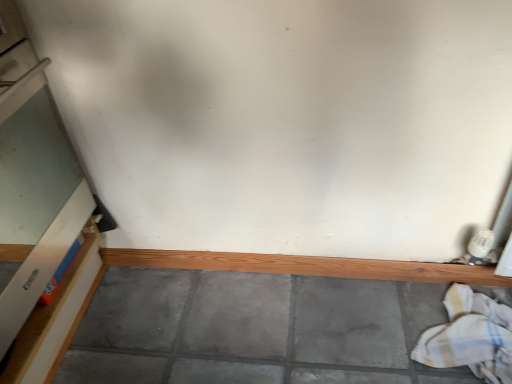
Question: Considering the relative sizes of wooden at bottom and white cotton laundry at lower right in the image provided, is wooden at bottom bigger than white cotton laundry at lower right?

Choices:
 (A) no
 (B) yes

Answer: (A)

Question: Is wooden at bottom shorter than white cotton laundry at lower right?

Choices:
 (A) yes
 (B) no

Answer: (A)

Question: Is wooden at bottom oriented towards white cotton laundry at lower right?

Choices:
 (A) yes
 (B) no

Answer: (A)

Question: Are wooden at bottom and white cotton laundry at lower right making contact?

Choices:
 (A) no
 (B) yes

Answer: (A)

Question: Is wooden at bottom closer to the viewer compared to white cotton laundry at lower right?

Choices:
 (A) no
 (B) yes

Answer: (A)

Question: Is wooden at bottom spatially inside white cardboard box at left, or outside of it?

Choices:
 (A) inside
 (B) outside

Answer: (B)

Question: Is wooden at bottom bigger or smaller than white cardboard box at left?

Choices:
 (A) small
 (B) big

Answer: (A)

Question: Considering the relative positions of wooden at bottom and white cardboard box at left in the image provided, is wooden at bottom to the left or to the right of white cardboard box at left?

Choices:
 (A) right
 (B) left

Answer: (A)

Question: From their relative heights in the image, would you say wooden at bottom is taller or shorter than white cardboard box at left?

Choices:
 (A) short
 (B) tall

Answer: (A)

Question: In the image, is wooden at bottom positioned in front of or behind white cotton laundry at lower right?

Choices:
 (A) front
 (B) behind

Answer: (B)

Question: Based on their positions, is wooden at bottom located to the left or right of white cotton laundry at lower right?

Choices:
 (A) left
 (B) right

Answer: (A)

Question: Considering the positions of point (273, 261) and point (490, 360), is point (273, 261) closer or farther from the camera than point (490, 360)?

Choices:
 (A) closer
 (B) farther

Answer: (B)

Question: In terms of width, does wooden at bottom look wider or thinner when compared to white cotton laundry at lower right?

Choices:
 (A) wide
 (B) thin

Answer: (B)

Question: Is white cardboard box at left wider or thinner than white cotton laundry at lower right?

Choices:
 (A) wide
 (B) thin

Answer: (A)

Question: From the image's perspective, is white cardboard box at left located above or below white cotton laundry at lower right?

Choices:
 (A) above
 (B) below

Answer: (A)